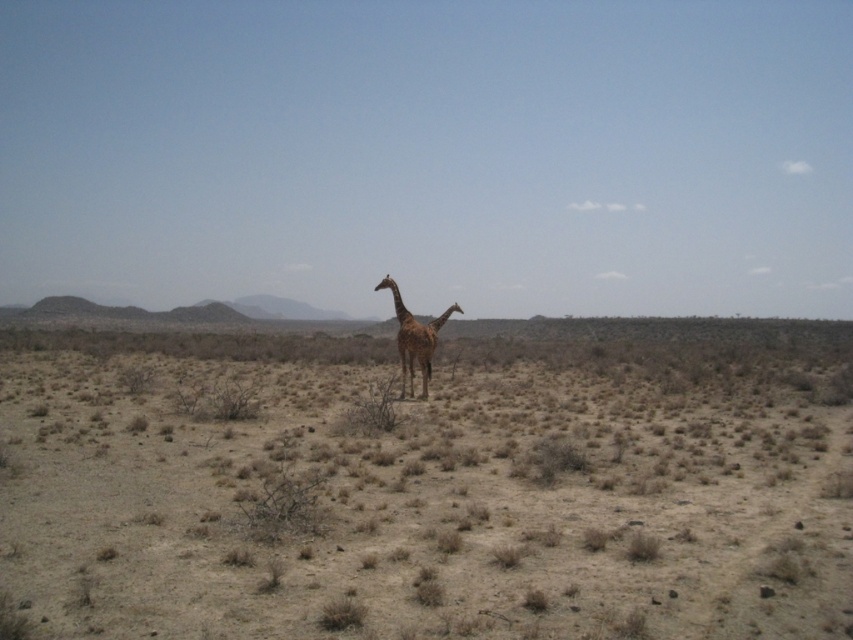
Question: Which object appears closest to the camera in this image?

Choices:
 (A) glossy brown giraffe at center
 (B) brown dry grass at center

Answer: (B)

Question: Can you confirm if brown dry grass at center is wider than glossy brown giraffe at center?

Choices:
 (A) yes
 (B) no

Answer: (A)

Question: Which object appears closest to the camera in this image?

Choices:
 (A) brown dry grass at center
 (B) glossy brown giraffe at center

Answer: (A)

Question: Among these objects, which one is farthest from the camera?

Choices:
 (A) glossy brown giraffe at center
 (B) brown dry grass at center

Answer: (A)

Question: Is brown dry grass at center further to camera compared to glossy brown giraffe at center?

Choices:
 (A) no
 (B) yes

Answer: (A)

Question: Can you confirm if brown dry grass at center is positioned to the left of glossy brown giraffe at center?

Choices:
 (A) yes
 (B) no

Answer: (B)